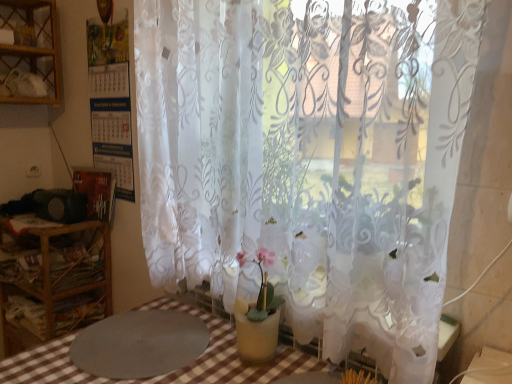
Question: Relative to transparent floral-patterned curtain at center, is wooden shelf at left in front or behind?

Choices:
 (A) front
 (B) behind

Answer: (B)

Question: From a real-world perspective, is wooden shelf at left physically located above or below transparent floral-patterned curtain at center?

Choices:
 (A) above
 (B) below

Answer: (B)

Question: Based on their relative distances, which object is nearer to the gray textured mat at lower left?

Choices:
 (A) transparent floral-patterned curtain at center
 (B) wooden shelf at upper left
 (C) wooden shelf at left

Answer: (A)

Question: Which object is the closest to the gray textured mat at lower left?

Choices:
 (A) wooden shelf at upper left
 (B) wooden shelf at left
 (C) transparent floral-patterned curtain at center

Answer: (C)